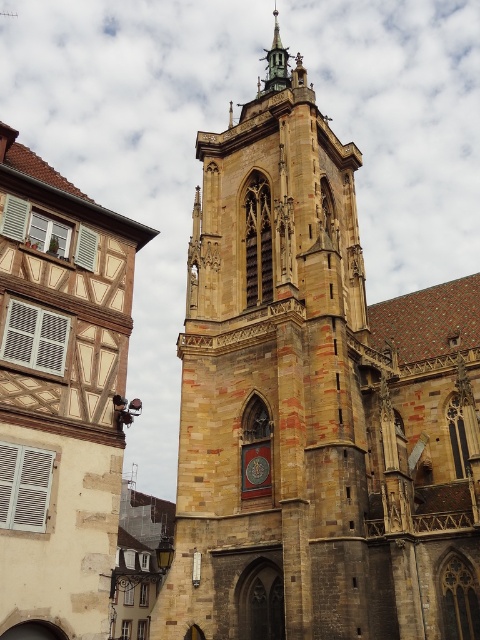
Question: Which object appears closest to the camera in this image?

Choices:
 (A) polished copper spire at upper center
 (B) wooden half-timbered house at left
 (C) brown stone tower at center

Answer: (B)

Question: Which of the following is the closest to the observer?

Choices:
 (A) brown stone tower at center
 (B) polished copper spire at upper center
 (C) wooden half-timbered house at left

Answer: (C)

Question: Does brown stone tower at center have a smaller size compared to wooden half-timbered house at left?

Choices:
 (A) no
 (B) yes

Answer: (A)

Question: Is wooden half-timbered house at left to the left of polished copper spire at upper center from the viewer's perspective?

Choices:
 (A) yes
 (B) no

Answer: (A)

Question: Among these points, which one is nearest to the camera?

Choices:
 (A) (113, 554)
 (B) (274, 83)

Answer: (A)

Question: Is brown stone tower at center wider than wooden half-timbered house at left?

Choices:
 (A) yes
 (B) no

Answer: (A)